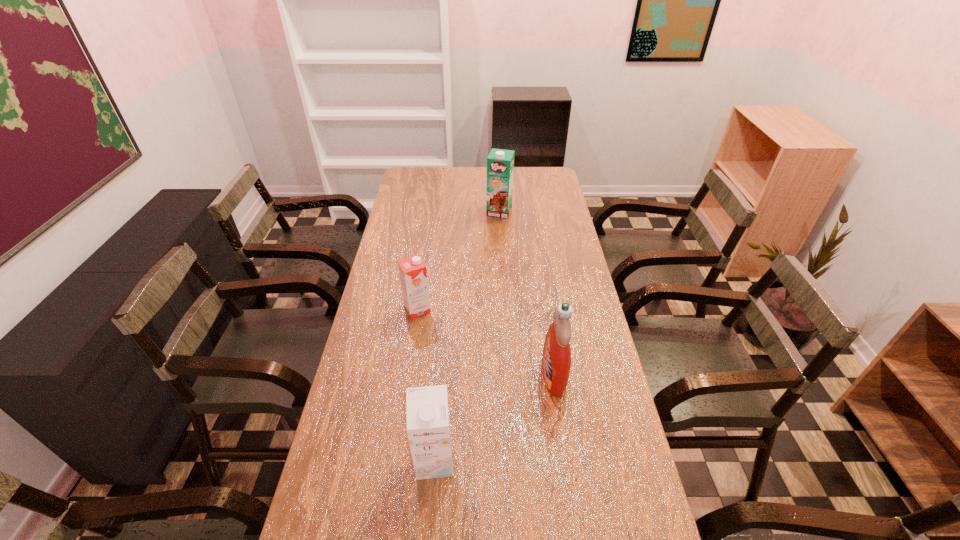
You are a GUI agent. You are given a task and a screenshot of the screen. Output one action in this format:
    pyautogui.click(x=<x>, y=<y>)
    Task: Click on the free space at the far right corner of the desktop
    This screenshot has width=960, height=540.
    Given the screenshot: What is the action you would take?
    pyautogui.click(x=526, y=177)

Locate an element on the screen. free spot between the third nearest object and the second nearest object is located at coordinates (486, 342).

Find the location of a particular element. This screenshot has height=540, width=960. empty space that is in between the detergent and the leftmost carton is located at coordinates (486, 342).

The width and height of the screenshot is (960, 540). I want to click on free spot between the detergent and the leftmost carton, so click(486, 342).

Locate an element on the screen. This screenshot has width=960, height=540. free space between the detergent and the farthest carton is located at coordinates (526, 293).

I want to click on vacant space that's between the nearest carton and the second nearest object, so click(493, 418).

Find the location of a particular element. vacant area that lies between the second nearest carton and the farthest carton is located at coordinates (458, 260).

The image size is (960, 540). In order to click on free space between the leftmost object and the second object from left to right in this screenshot , I will do `click(426, 385)`.

I want to click on vacant point located between the farthest object and the second carton from right to left, so click(x=467, y=336).

What are the coordinates of `vacant point located between the farthest object and the leftmost object` in the screenshot? It's located at [x=458, y=260].